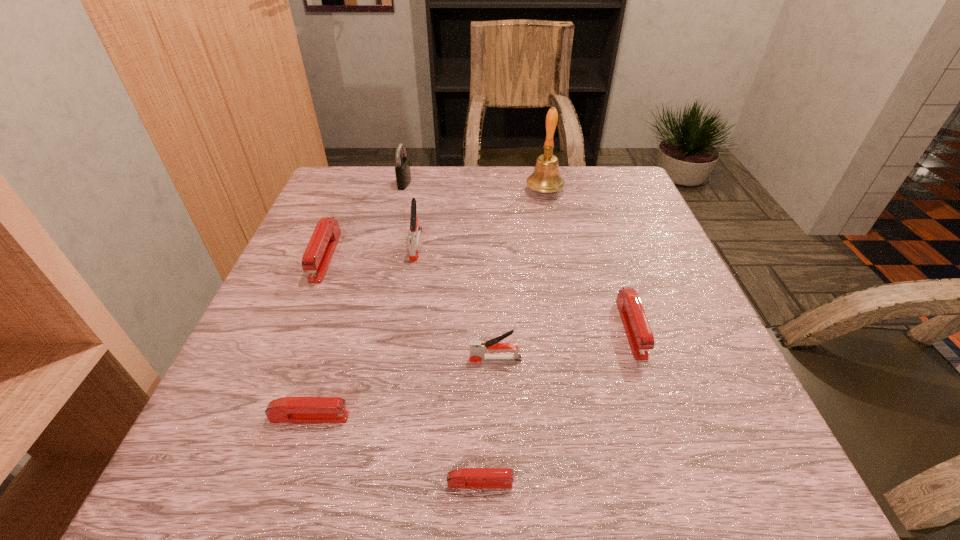
You are a GUI agent. You are given a task and a screenshot of the screen. Output one action in this format:
    pyautogui.click(x=<x>, y=<y>)
    Task: Click on the seventh object from left to right
    
    Given the screenshot: What is the action you would take?
    pyautogui.click(x=546, y=178)

You are a GUI agent. You are given a task and a screenshot of the screen. Output one action in this format:
    pyautogui.click(x=<x>, y=<y>)
    Task: Click on the bell
    This screenshot has height=540, width=960.
    Given the screenshot: What is the action you would take?
    pyautogui.click(x=546, y=178)

Find the location of a particular element. The height and width of the screenshot is (540, 960). padlock is located at coordinates (402, 169).

Image resolution: width=960 pixels, height=540 pixels. I want to click on the fifth object from right to left, so click(x=413, y=238).

You are a GUI agent. You are given a task and a screenshot of the screen. Output one action in this format:
    pyautogui.click(x=<x>, y=<y>)
    Task: Click on the bigger gray stapler
    
    Given the screenshot: What is the action you would take?
    pyautogui.click(x=413, y=238)

Where is `the nearer gray stapler`? Image resolution: width=960 pixels, height=540 pixels. the nearer gray stapler is located at coordinates (478, 348).

At what (x,y) coordinates should I click in order to perform the action: click on the smaller gray stapler. Please return your answer as a coordinate pair (x, y). Looking at the image, I should click on (478, 348).

You are a GUI agent. You are given a task and a screenshot of the screen. Output one action in this format:
    pyautogui.click(x=<x>, y=<y>)
    Task: Click on the biggest red stapler
    This screenshot has height=540, width=960.
    Given the screenshot: What is the action you would take?
    tap(320, 249)

Find the location of a particular element. the farthest red stapler is located at coordinates (320, 249).

Identify the location of the rightmost stapler. (638, 331).